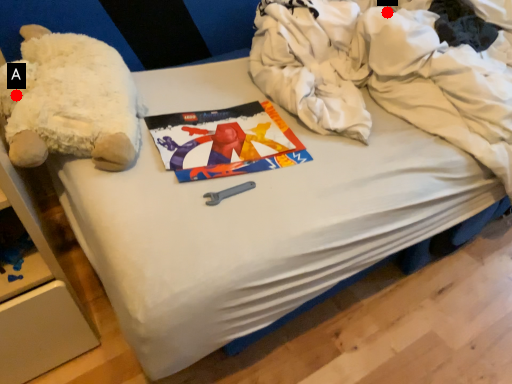
Question: Two points are circled on the image, labeled by A and B beside each circle. Which point is farther to the camera?

Choices:
 (A) A is further
 (B) B is further

Answer: (B)